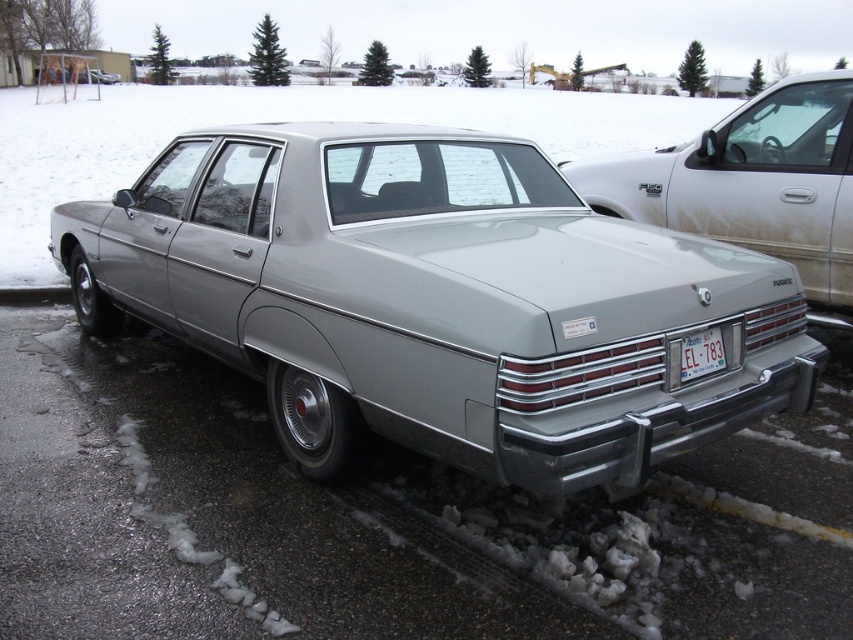
Looking at this image, does satin silver sedan at center have a lesser width compared to silver metallic sedan at center?

No, satin silver sedan at center is not thinner than silver metallic sedan at center.

Who is more distant from viewer, (543, 490) or (643, 198)?

The point (643, 198) is behind.

Find the location of a particular element. This screenshot has height=640, width=853. satin silver sedan at center is located at coordinates (438, 300).

Can you confirm if silver metallic sedan at center is positioned above white plastic license plate at lower center?

Yes, silver metallic sedan at center is above white plastic license plate at lower center.

From the picture: Is silver metallic sedan at center below white plastic license plate at lower center?

No, silver metallic sedan at center is not below white plastic license plate at lower center.

Is point (711, 179) closer to camera compared to point (724, 368)?

No.

Locate an element on the screen. This screenshot has height=640, width=853. silver metallic sedan at center is located at coordinates (752, 182).

Does metallic gray car at center appear over white plastic license plate at lower center?

Actually, metallic gray car at center is below white plastic license plate at lower center.

Does metallic gray car at center have a larger size compared to white plastic license plate at lower center?

Correct, metallic gray car at center is larger in size than white plastic license plate at lower center.

Is point (479, 566) positioned after point (703, 332)?

No, it is not.

Locate an element on the screen. This screenshot has height=640, width=853. metallic gray car at center is located at coordinates (376, 520).